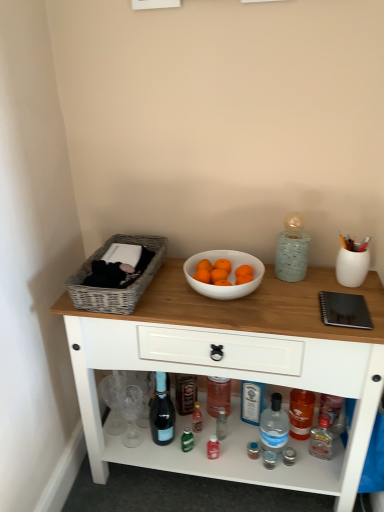
Question: Is woven gray basket at left smaller than matte glass bottle at center, placed as the 1th bottle when sorted from left to right?

Choices:
 (A) no
 (B) yes

Answer: (A)

Question: From the image's perspective, is woven gray basket at left under matte glass bottle at center, placed as the 1th bottle when sorted from left to right?

Choices:
 (A) no
 (B) yes

Answer: (A)

Question: Is woven gray basket at left further to camera compared to matte glass bottle at center, placed as the 1th bottle when sorted from left to right?

Choices:
 (A) no
 (B) yes

Answer: (A)

Question: From a real-world perspective, is woven gray basket at left below matte glass bottle at center, which is the 2th bottle from right to left?

Choices:
 (A) yes
 (B) no

Answer: (B)

Question: Does woven gray basket at left have a greater height compared to matte glass bottle at center, placed as the 1th bottle when sorted from left to right?

Choices:
 (A) no
 (B) yes

Answer: (A)

Question: Is woven gray basket at left not inside matte glass bottle at center, placed as the 1th bottle when sorted from left to right?

Choices:
 (A) yes
 (B) no

Answer: (A)

Question: Is transparent plastic bottle at lower center, placed as the first bottle when sorted from right to left, surrounding wooden table at center?

Choices:
 (A) yes
 (B) no

Answer: (B)

Question: Can you confirm if transparent plastic bottle at lower center, which ranks as the second bottle in left-to-right order, is wider than wooden table at center?

Choices:
 (A) no
 (B) yes

Answer: (A)

Question: From the image's perspective, is transparent plastic bottle at lower center, placed as the first bottle when sorted from right to left, under wooden table at center?

Choices:
 (A) yes
 (B) no

Answer: (A)

Question: Can you confirm if transparent plastic bottle at lower center, placed as the first bottle when sorted from right to left, is thinner than wooden table at center?

Choices:
 (A) yes
 (B) no

Answer: (A)

Question: From a real-world perspective, is transparent plastic bottle at lower center, placed as the first bottle when sorted from right to left, below wooden table at center?

Choices:
 (A) yes
 (B) no

Answer: (A)

Question: Can you confirm if transparent plastic bottle at lower center, which ranks as the second bottle in left-to-right order, is bigger than wooden table at center?

Choices:
 (A) yes
 (B) no

Answer: (B)

Question: From the image's perspective, does wooden table at center appear lower than transparent plastic bottle at lower center, placed as the first bottle when sorted from right to left?

Choices:
 (A) no
 (B) yes

Answer: (A)